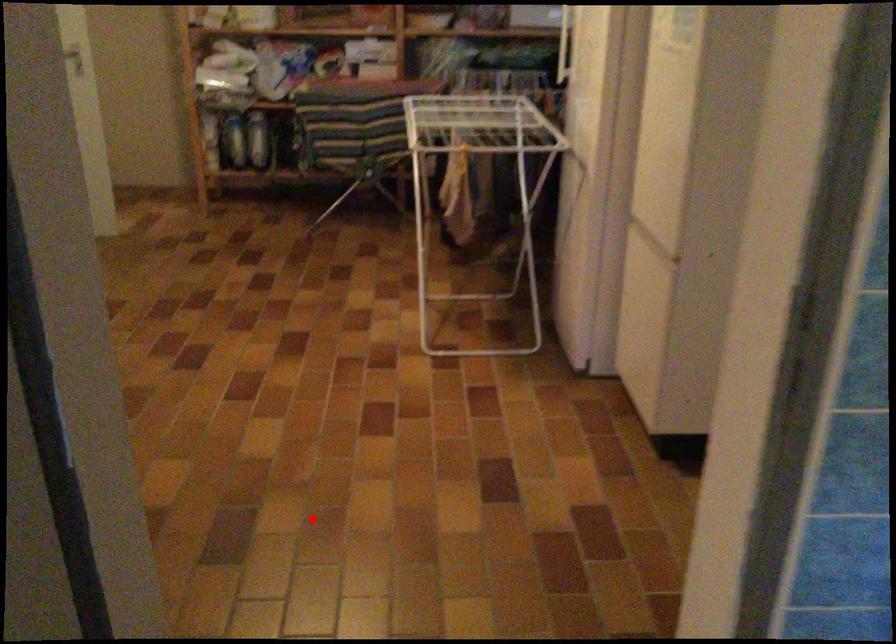
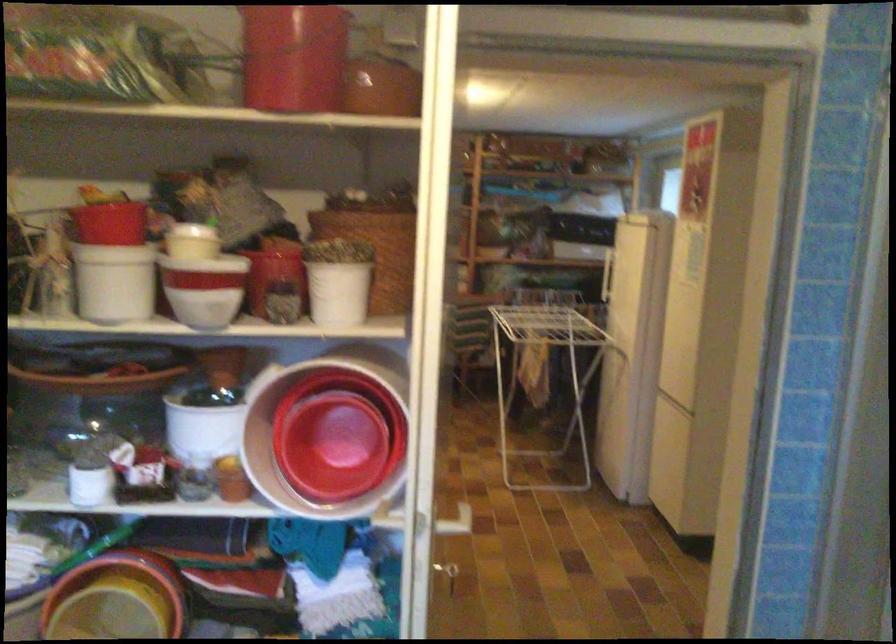
Question: I am providing you with two images of the same scene from different viewpoints. A red point is marked on the first image. At the location where the point appears in image 1, is it still visible in image 2?

Choices:
 (A) Yes
 (B) No

Answer: (A)